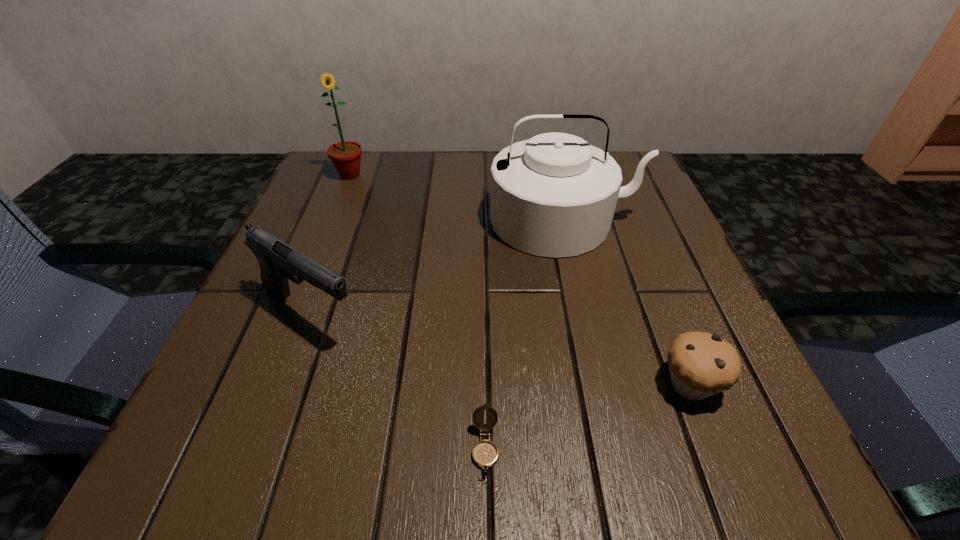
I want to click on unoccupied position between the nearest object and the second shortest object, so click(x=588, y=417).

Identify the location of vacant point located between the farthest object and the muffin. The height and width of the screenshot is (540, 960). (520, 280).

What are the coordinates of `free space between the muffin and the gun` in the screenshot? It's located at [x=500, y=349].

Where is `free area in between the nearest object and the fourth nearest object`? free area in between the nearest object and the fourth nearest object is located at coordinates (525, 335).

Find the location of a particular element. This screenshot has width=960, height=540. unoccupied position between the kettle and the nearest object is located at coordinates (525, 335).

Find the location of `vacant region between the fourth nearest object and the sunflower`. vacant region between the fourth nearest object and the sunflower is located at coordinates (457, 197).

Identify the location of free point between the farthest object and the muffin. (520, 280).

Choose which object is the fourth nearest neighbor to the shortest object. Please provide its 2D coordinates. Your answer should be formatted as a tuple, i.e. [(x, y)], where the tuple contains the x and y coordinates of a point satisfying the conditions above.

[(346, 155)]

Identify which object is the fourth nearest to the fourth nearest object. Please provide its 2D coordinates. Your answer should be formatted as a tuple, i.e. [(x, y)], where the tuple contains the x and y coordinates of a point satisfying the conditions above.

[(485, 453)]

Where is `free space that satisfies the following two spatial constraints: 1. on the spout of the kettle; 2. on the right side of the fourth farthest object`? This screenshot has height=540, width=960. free space that satisfies the following two spatial constraints: 1. on the spout of the kettle; 2. on the right side of the fourth farthest object is located at coordinates (602, 384).